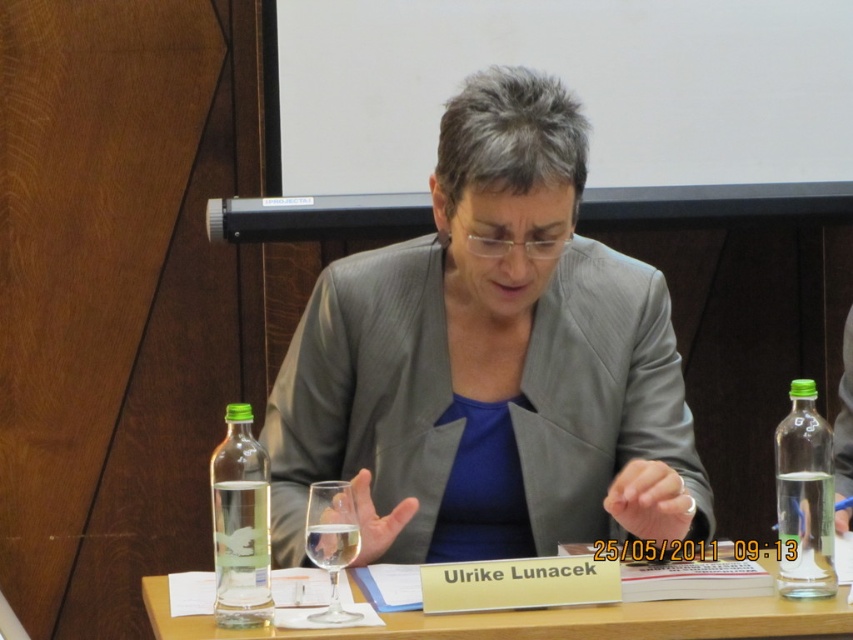
Question: Is the position of clear glass bottle at left more distant than that of clear glass wine glass at center?

Choices:
 (A) yes
 (B) no

Answer: (B)

Question: Can you confirm if wooden table at center is thinner than clear glass bottle at right?

Choices:
 (A) yes
 (B) no

Answer: (B)

Question: Does wooden table at center appear over clear glass wine glass at center?

Choices:
 (A) no
 (B) yes

Answer: (A)

Question: Which of the following is the closest to the observer?

Choices:
 (A) [813, 602]
 (B) [315, 532]
 (C) [216, 550]

Answer: (B)

Question: Which object is the closest to the gray fabric jacket at center?

Choices:
 (A) wooden table at center
 (B) clear glass bottle at right
 (C) clear glass wine glass at center

Answer: (A)

Question: Among these points, which one is farthest from the camera?

Choices:
 (A) (793, 548)
 (B) (248, 637)
 (C) (311, 529)

Answer: (A)